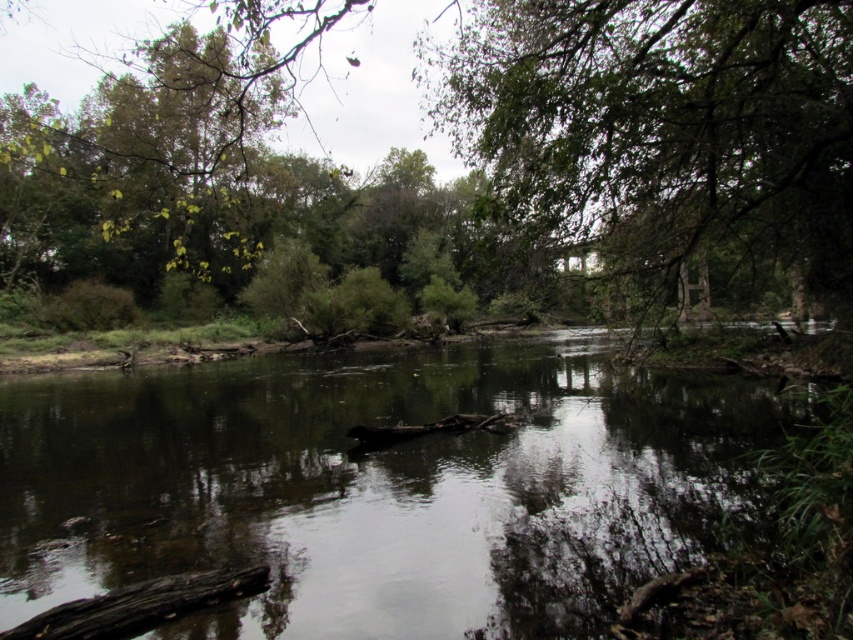
From the picture: You are a kayaker planning to navigate the river shown in the image. You need to know which area is larger between the smooth reflective water at center and the dark brown wood log at lower left to choose the safest route. Which one is larger?

The smooth reflective water at center is bigger than the dark brown wood log at lower left, so the smooth reflective water at center is the larger area and would be the safer route for navigation.

You are a kayaker planning to navigate the river shown in the image. You need to know if the width of the smooth reflective water at center is sufficient to pass through between the green leafy tree at upper center and another tree on the opposite bank. Can you confirm if the water is wide enough?

The smooth reflective water at center has a larger width than the green leafy tree at upper center, so yes, the water is wide enough for the kayak to pass through between the tree and the opposite bank.

You are a kayaker planning to navigate the river shown in the image. You see the smooth reflective water at center and the dark brown wood log at lower left. Which direction should you paddle to avoid hitting the log?

You should paddle to the right to avoid hitting the dark brown wood log at lower left since the smooth reflective water at center is to the left of the log, indicating the log is on your left side.